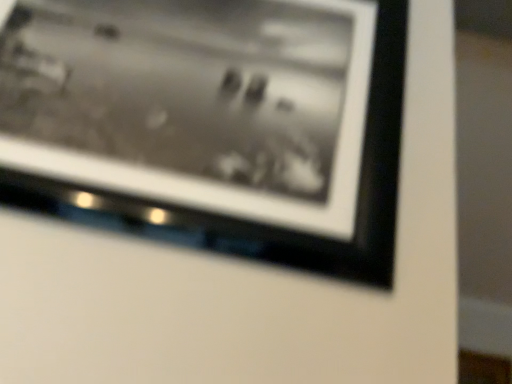
Identify the location of black glossy picture frame at upper center. The width and height of the screenshot is (512, 384). (210, 126).

What do you see at coordinates (210, 126) in the screenshot? I see `black glossy picture frame at upper center` at bounding box center [210, 126].

Find the location of a particular element. black glossy picture frame at upper center is located at coordinates point(210,126).